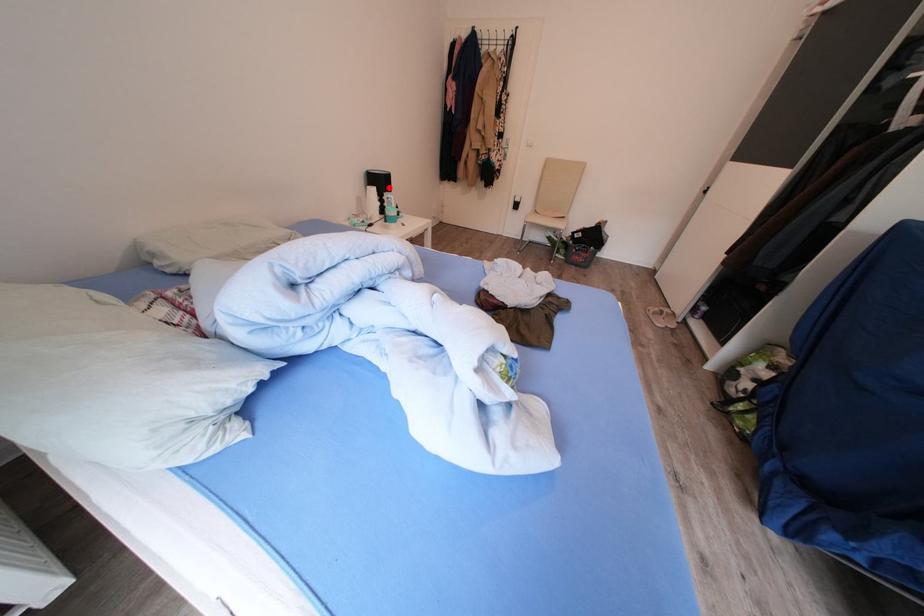
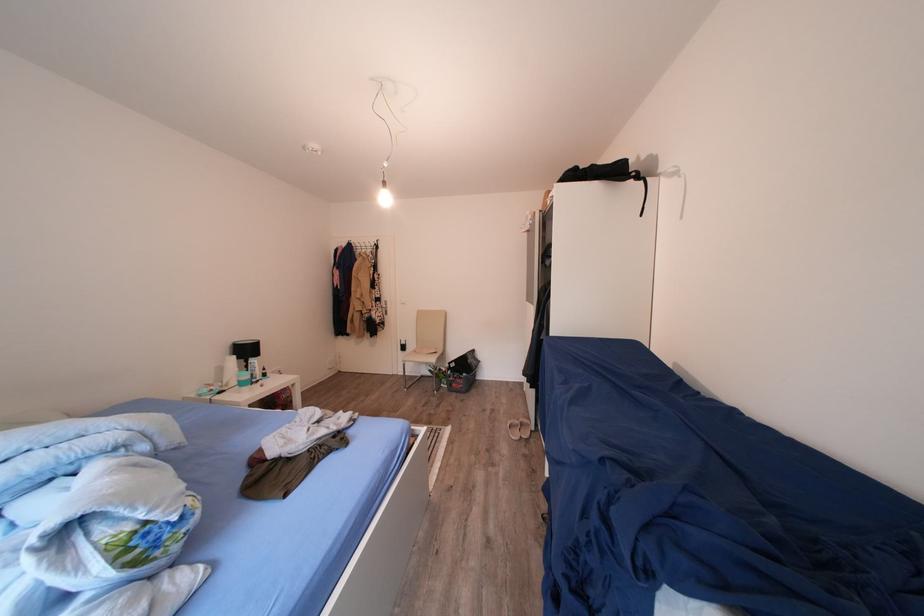
Question: A red point is marked in image1. In image2, is the corresponding 3D point closer to the camera or farther? Reply with the corresponding letter.

Choices:
 (A) The corresponding 3D point is closer.
 (B) The corresponding 3D point is farther.

Answer: (B)